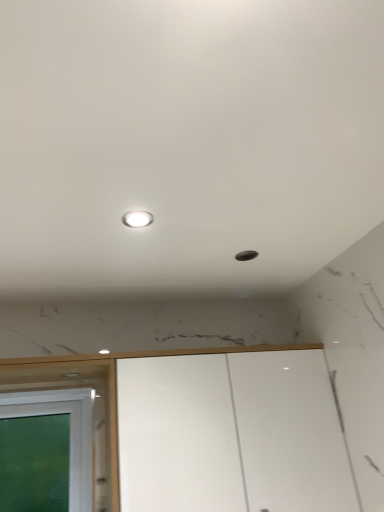
Question: Should I look upward or downward to see green glass window at lower left?

Choices:
 (A) up
 (B) down

Answer: (B)

Question: From the image's perspective, is green glass window at lower left on white glossy light at upper center?

Choices:
 (A) no
 (B) yes

Answer: (A)

Question: Does green glass window at lower left have a lesser height compared to white glossy light at upper center?

Choices:
 (A) no
 (B) yes

Answer: (A)

Question: Does green glass window at lower left appear on the right side of white glossy light at upper center?

Choices:
 (A) no
 (B) yes

Answer: (A)

Question: Does green glass window at lower left have a larger size compared to white glossy light at upper center?

Choices:
 (A) yes
 (B) no

Answer: (A)

Question: Does green glass window at lower left lie in front of white glossy light at upper center?

Choices:
 (A) yes
 (B) no

Answer: (B)

Question: Does green glass window at lower left have a greater width compared to white glossy light at upper center?

Choices:
 (A) no
 (B) yes

Answer: (A)

Question: Is white glossy cabinet at lower center beside green glass window at lower left?

Choices:
 (A) no
 (B) yes

Answer: (A)

Question: Is white glossy cabinet at lower center in front of green glass window at lower left?

Choices:
 (A) no
 (B) yes

Answer: (B)

Question: From the image's perspective, would you say white glossy cabinet at lower center is positioned over green glass window at lower left?

Choices:
 (A) no
 (B) yes

Answer: (B)

Question: Is white glossy cabinet at lower center not within green glass window at lower left?

Choices:
 (A) no
 (B) yes

Answer: (B)

Question: From a real-world perspective, does white glossy cabinet at lower center stand above green glass window at lower left?

Choices:
 (A) yes
 (B) no

Answer: (B)

Question: Considering the relative positions of white glossy cabinet at lower center and green glass window at lower left in the image provided, is white glossy cabinet at lower center to the right of green glass window at lower left from the viewer's perspective?

Choices:
 (A) no
 (B) yes

Answer: (B)

Question: Is white glossy cabinet at lower center positioned with its back to white glossy light at upper center?

Choices:
 (A) no
 (B) yes

Answer: (A)